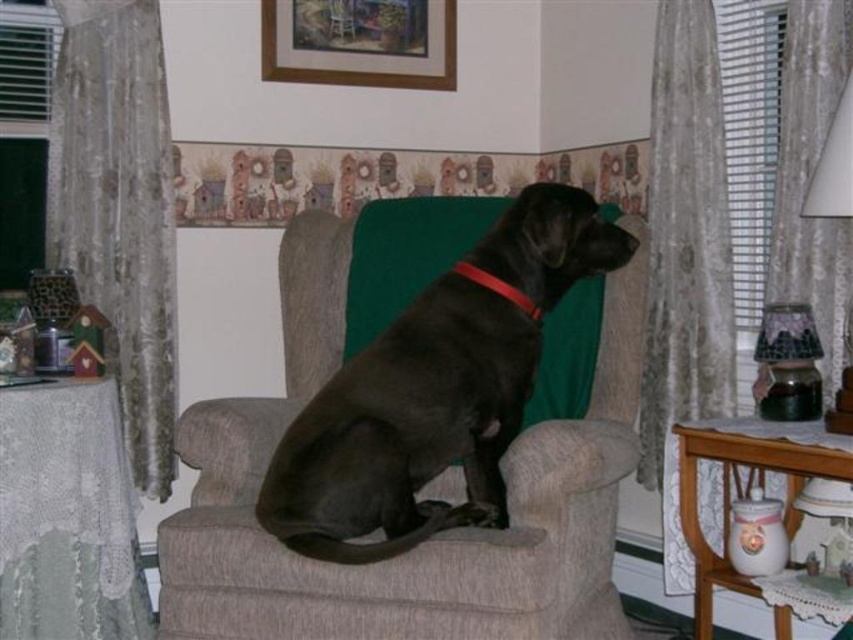
Is black smooth dog at center below wooden picture frame at upper center?

Correct, black smooth dog at center is located below wooden picture frame at upper center.

At what (x,y) coordinates should I click in order to perform the action: click on black smooth dog at center. Please return your answer as a coordinate pair (x, y). The image size is (853, 640). Looking at the image, I should click on (405, 428).

This screenshot has height=640, width=853. What are the coordinates of `black smooth dog at center` in the screenshot? It's located at (405, 428).

Between silvery lace curtain at left and wooden picture frame at upper center, which one appears on the left side from the viewer's perspective?

silvery lace curtain at left is more to the left.

Looking at this image, does silvery lace curtain at left come in front of wooden picture frame at upper center?

That is True.

Measure the distance between point (166, 97) and camera.

A distance of 9.60 feet exists between point (166, 97) and camera.

This screenshot has width=853, height=640. I want to click on silvery lace curtain at left, so click(119, 209).

Based on the photo, is wooden picture frame at upper center above red leather collar at center?

Correct, wooden picture frame at upper center is located above red leather collar at center.

Is point (405, 76) positioned before point (525, 310)?

No, (405, 76) is behind (525, 310).

This screenshot has height=640, width=853. Describe the element at coordinates (360, 42) in the screenshot. I see `wooden picture frame at upper center` at that location.

The image size is (853, 640). Find the location of `wooden picture frame at upper center`. wooden picture frame at upper center is located at coordinates (360, 42).